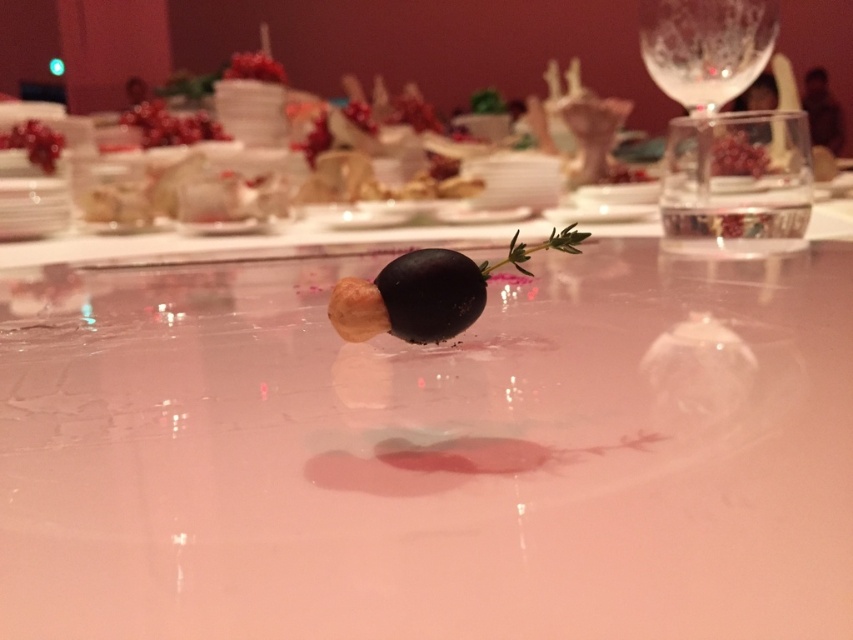
Question: Is the position of shiny white table at center more distant than that of clear textured glass at upper right?

Choices:
 (A) no
 (B) yes

Answer: (A)

Question: Observing the image, what is the correct spatial positioning of shiny white table at center in reference to shiny red berries at upper center?

Choices:
 (A) right
 (B) left

Answer: (A)

Question: Which point is closer to the camera?

Choices:
 (A) (9, 138)
 (B) (457, 326)

Answer: (B)

Question: Is shiny white table at center positioned in front of shiny red berries at upper center?

Choices:
 (A) no
 (B) yes

Answer: (B)

Question: Which point is farther from the camera taking this photo?

Choices:
 (A) (177, 120)
 (B) (338, 310)

Answer: (A)

Question: Considering the real-world distances, which object is farthest from the shiny white table at center?

Choices:
 (A) shiny black olive at center
 (B) clear textured glass at upper right
 (C) pomegranate seeds at upper left
 (D) shiny red berries at upper center

Answer: (C)